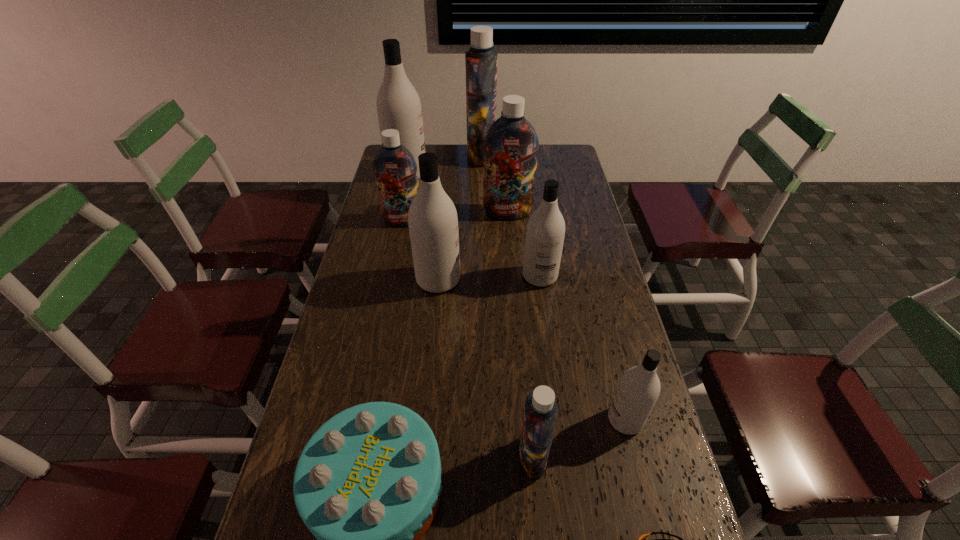
This screenshot has height=540, width=960. Identify the location of vacant region at the far right corner of the desktop. (570, 151).

This screenshot has height=540, width=960. Find the location of `empty location between the rightmost shampoo and the smallest blue shampoo`. empty location between the rightmost shampoo and the smallest blue shampoo is located at coordinates (579, 438).

You are a GUI agent. You are given a task and a screenshot of the screen. Output one action in this format:
    pyautogui.click(x=<x>, y=<y>)
    Task: Click on the free spot between the biggest blue shampoo and the third white shampoo from right to left
    
    Given the screenshot: What is the action you would take?
    pyautogui.click(x=460, y=218)

Locate an element on the screen. Image resolution: width=960 pixels, height=540 pixels. free space between the second white shampoo from right to left and the third white shampoo from right to left is located at coordinates 490,278.

I want to click on free point between the leftmost blue shampoo and the rightmost white shampoo, so click(514, 321).

Find the location of a particular element. This screenshot has height=540, width=960. vacant space that is in between the third smallest blue shampoo and the rightmost white shampoo is located at coordinates point(566,316).

The image size is (960, 540). I want to click on the closest object to the smallest blue shampoo, so pos(638,390).

Point out which object is positioned as the ninth nearest to the shortest object. Please provide its 2D coordinates. Your answer should be formatted as a tuple, i.e. [(x, y)], where the tuple contains the x and y coordinates of a point satisfying the conditions above.

[(481, 60)]

Identify the location of shampoo that can be found as the sixth closest to the third shampoo from left to right. (638, 390).

Identify which shampoo is the fifth nearest to the farthest white shampoo. Please provide its 2D coordinates. Your answer should be formatted as a tuple, i.e. [(x, y)], where the tuple contains the x and y coordinates of a point satisfying the conditions above.

[(545, 233)]